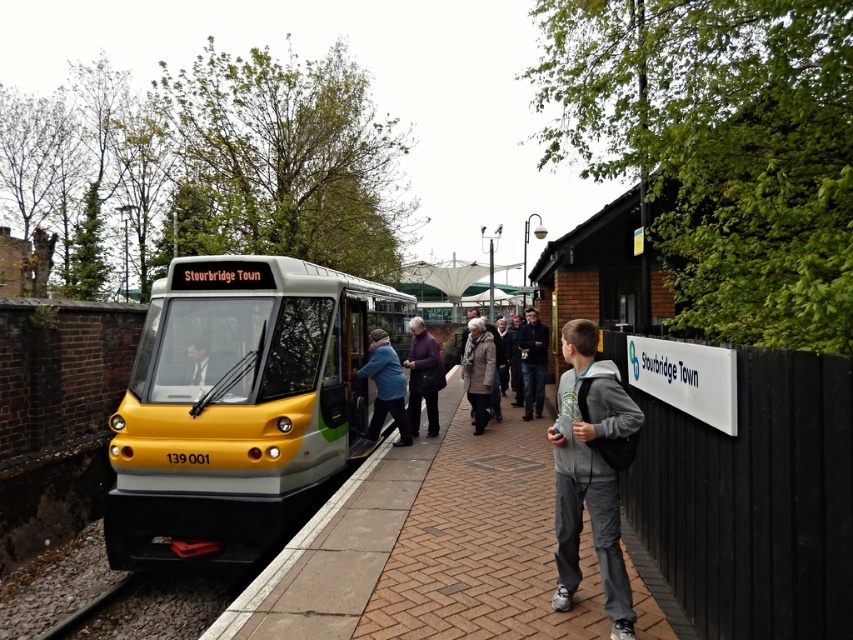
You are a passenger waiting to board the train at Stourbridge Town station. You notice two jackets hanging on the fence next to you. The jackets are labeled as the gray fleece jacket at center and the dark gray jacket at center. Which jacket is shorter in height?

The gray fleece jacket at center is shorter than the dark gray jacket at center.

Looking at this image, you are a maintenance worker checking the height clearance for a new overhead structure at the Stourbridge Town station. The structure must be at least 1.5 meters taller than the yellow metallic train at center to accommodate it. Given the brick platform at center is currently at ground level, can the proposed structure be safely installed without any modifications?

The yellow metallic train at center is much taller than the brick platform at center. Since the brick platform is at ground level, the structure needs to be 1.5 meters taller than the train. However, the platform itself does not provide height data, so the exact clearance requirement must be measured directly from the train to ensure compliance.